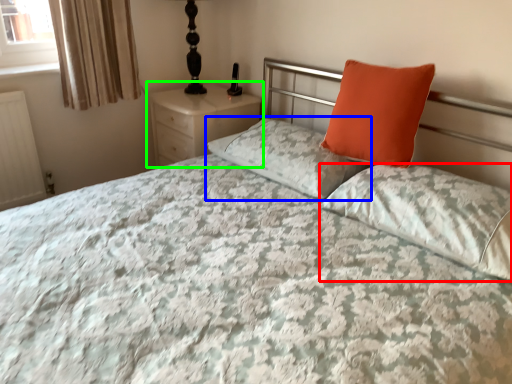
Question: Estimate the real-world distances between objects in this image. Which object is farther from pillow (highlighted by a red box), pillow (highlighted by a blue box) or nightstand (highlighted by a green box)?

Choices:
 (A) pillow
 (B) nightstand

Answer: (B)